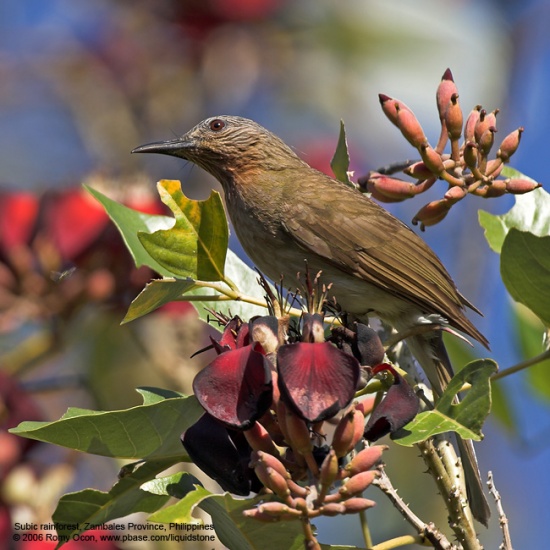
At what (x,y) coordinates should I click in order to perform the action: click on dead flower. Please return your answer as a coordinate pair (x, y). Looking at the image, I should click on (310, 379).